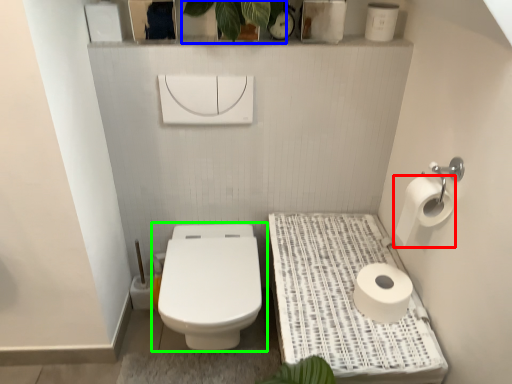
Question: Considering the real-world distances, which object is closest to toilet paper (highlighted by a red box)? plant (highlighted by a blue box) or toilet (highlighted by a green box).

Choices:
 (A) plant
 (B) toilet

Answer: (B)